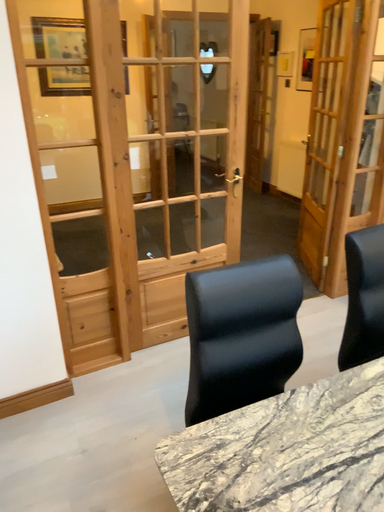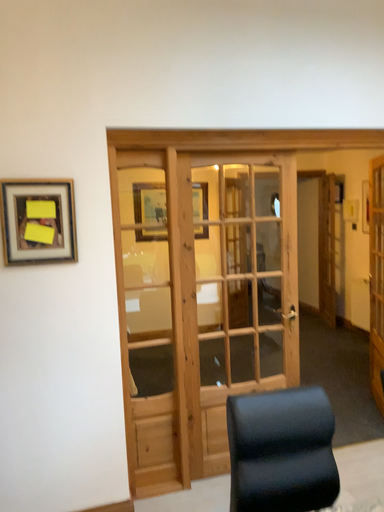
Question: How did the camera likely rotate when shooting the video?

Choices:
 (A) rotated right
 (B) rotated left

Answer: (B)